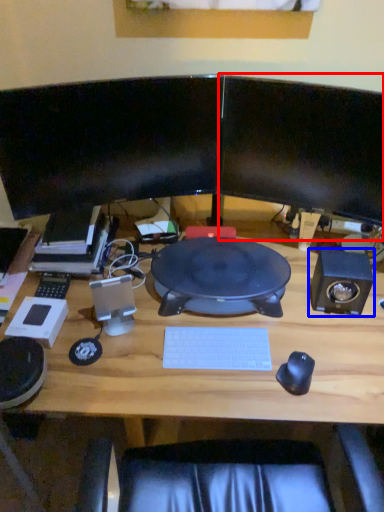
Question: Which object appears farthest to the camera in this image, computer monitor (highlighted by a red box) or speaker (highlighted by a blue box)?

Choices:
 (A) computer monitor
 (B) speaker

Answer: (B)